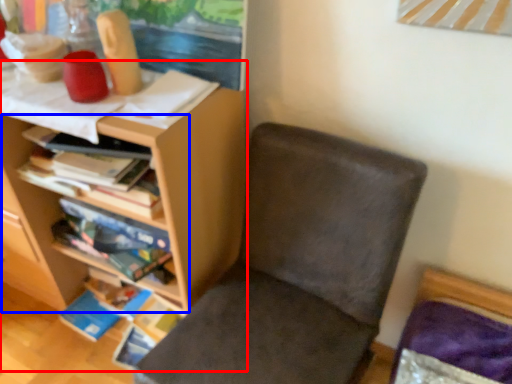
Question: Which of the following is the farthest to the observer, shelf (highlighted by a red box) or shelf (highlighted by a blue box)?

Choices:
 (A) shelf
 (B) shelf

Answer: (B)